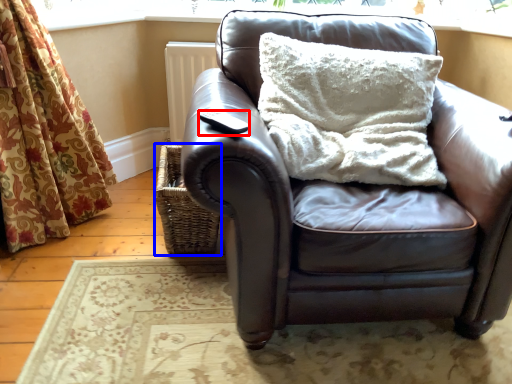
Question: Among these objects, which one is nearest to the camera, pad (highlighted by a red box) or basket (highlighted by a blue box)?

Choices:
 (A) pad
 (B) basket

Answer: (A)